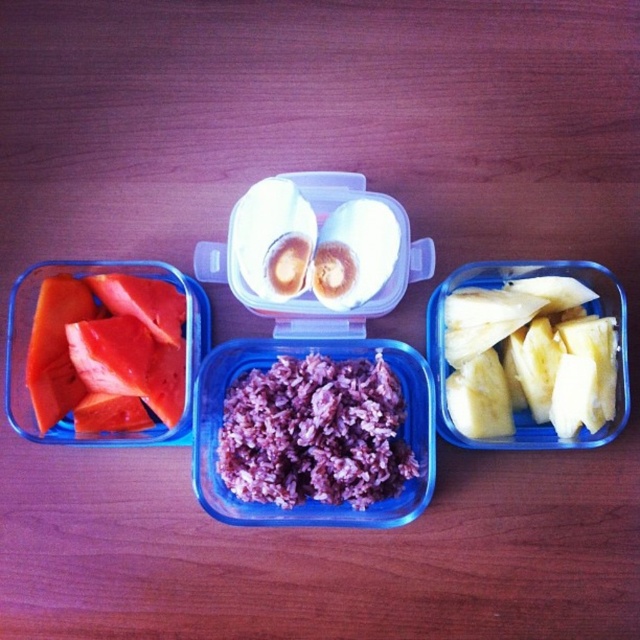
You are a drone operator trying to deliver a small package to one of the two points in the image. The package can only be dropped at a point that is closer to the camera. Which point should you choose between point (332, 445) and point (508, 384)?

Point (332, 445) is closer to the camera than point (508, 384), so you should choose point (332, 445) to drop the package.